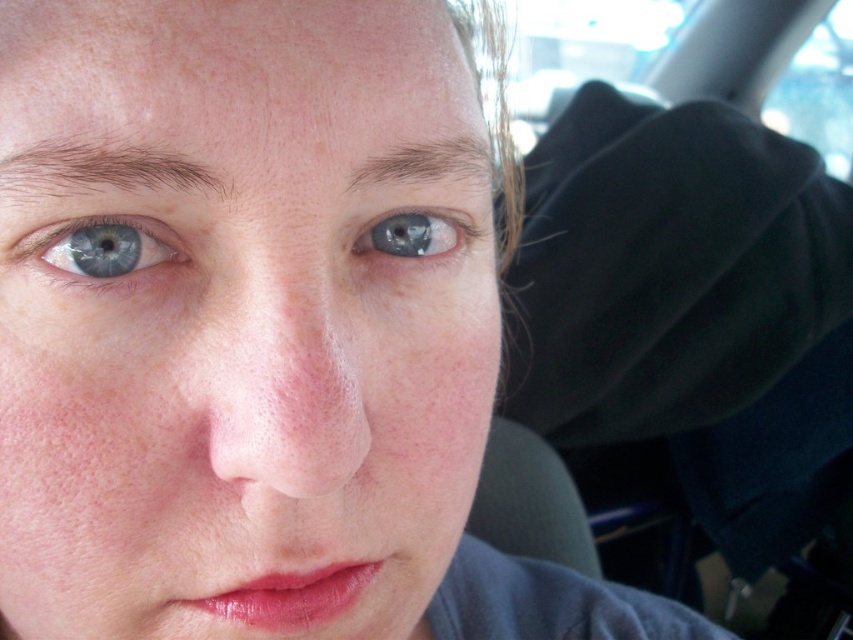
You are a photographer trying to capture a closeup of a person. You are currently positioned at point (119,323). The camera is 25.69 centimeters away from you. Can you determine if you are within the ideal shooting distance of 30 centimeters for a portrait? Please explain your reasoning.

The camera is 25.69 centimeters away from point (119,323). Since 25.69 cm is less than the ideal 30 cm distance, you are within the recommended range for capturing a close portrait.